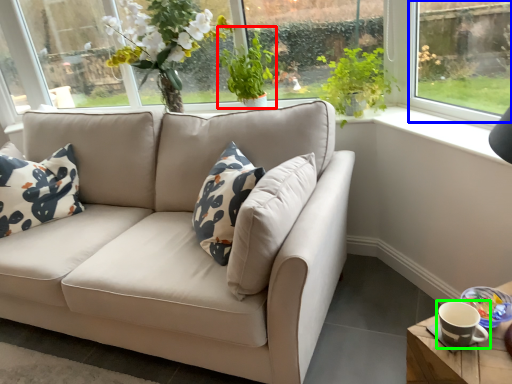
Question: Which is farther away from plant (highlighted by a red box)? window (highlighted by a blue box) or coffee cup (highlighted by a green box)?

Choices:
 (A) window
 (B) coffee cup

Answer: (B)